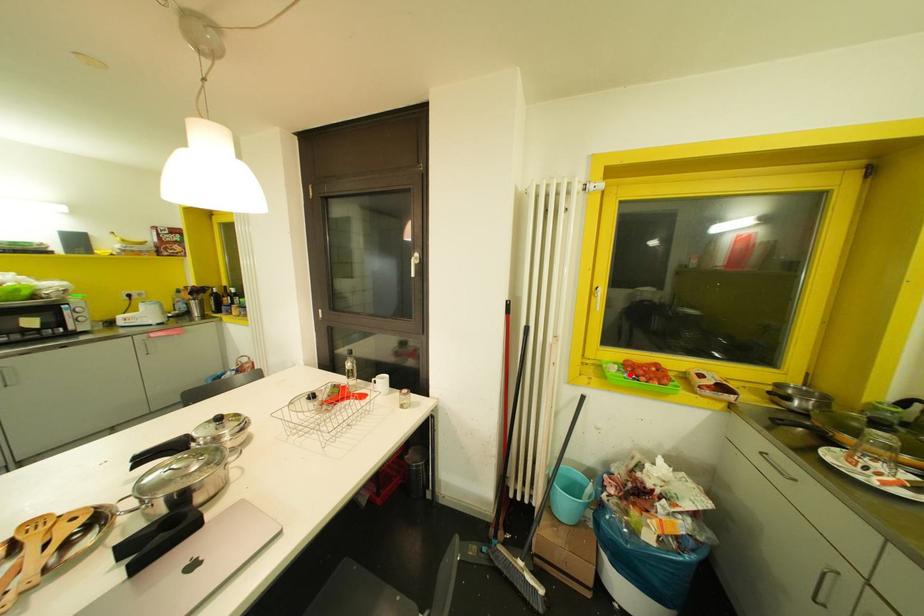
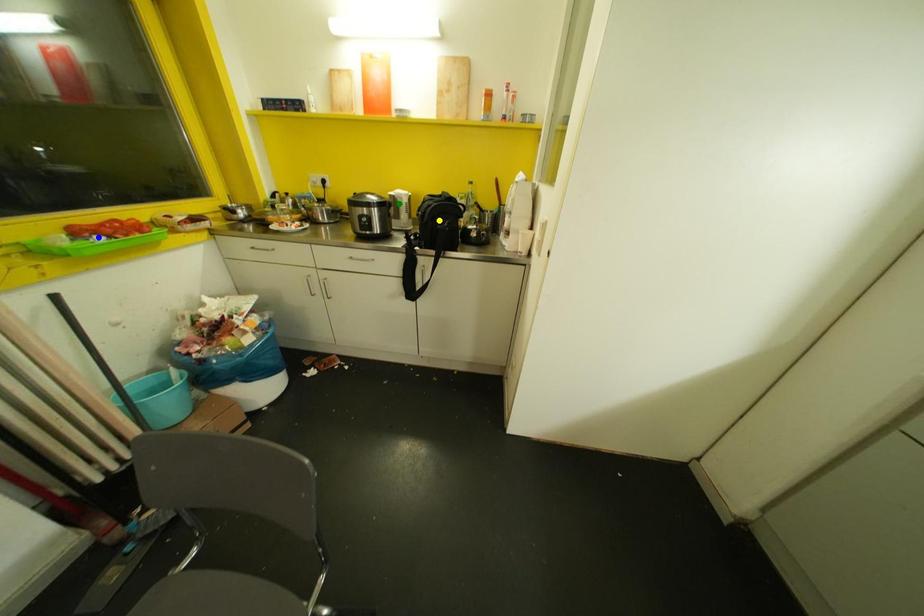
Question: I am providing you with two images of the same scene from different viewpoints. A red point is marked on the first image. You are given multiple points on the second image. Which spot in image 2 lines up with the point in image 1?

Choices:
 (A) yellow point
 (B) blue point
 (C) green point

Answer: (B)